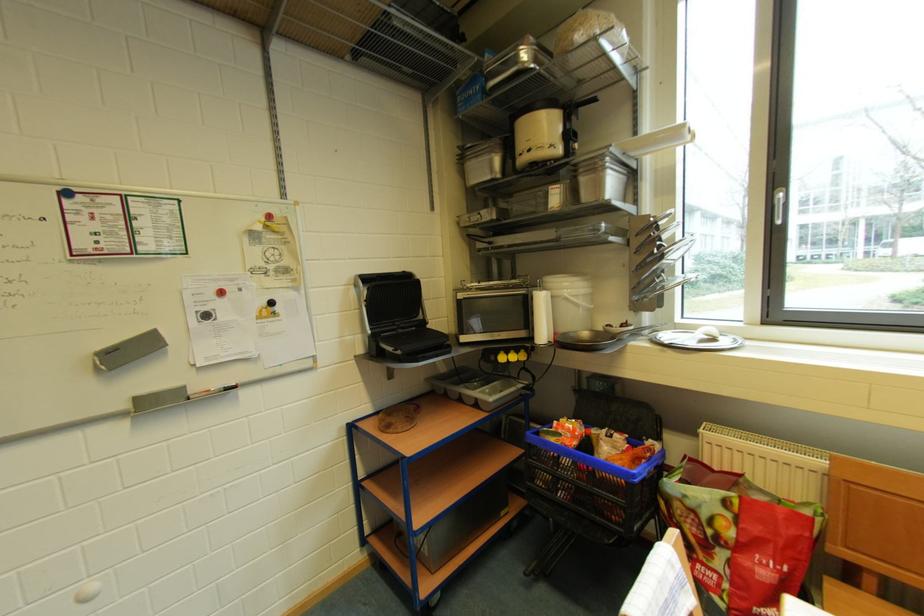
Where would you pull the plastic wrap dispenser? Please return your answer as a coordinate pair (x, y).

(569, 301)